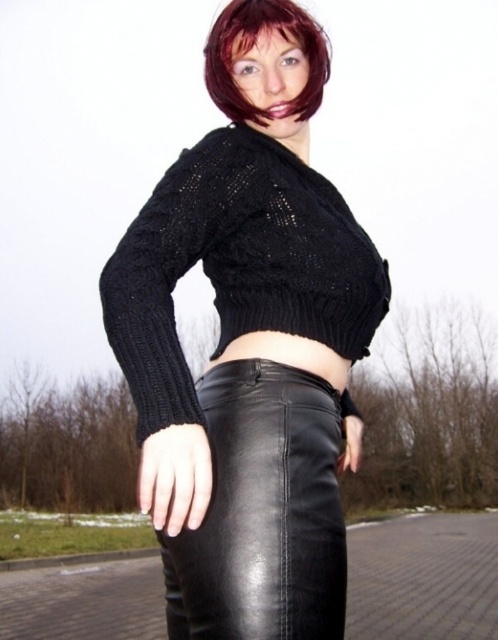
Can you confirm if black leather skirt at lower center is thinner than dark brown hair at upper center?

No, black leather skirt at lower center is not thinner than dark brown hair at upper center.

Which is in front, point (336, 572) or point (252, 112)?

Point (336, 572)

Where is `black leather skirt at lower center`? This screenshot has height=640, width=498. black leather skirt at lower center is located at coordinates (262, 513).

Who is taller, black leather skirt at center or dark red hair at upper center?

With more height is black leather skirt at center.

Can you confirm if black leather skirt at center is taller than dark red hair at upper center?

Correct, black leather skirt at center is much taller as dark red hair at upper center.

Is point (343, 396) in front of point (236, 33)?

That is False.

This screenshot has height=640, width=498. Find the location of `black leather skirt at center`. black leather skirt at center is located at coordinates (249, 349).

Which is behind, point (211, 408) or point (268, 33)?

The point (268, 33) is behind.

Does point (296, 636) come in front of point (250, 29)?

Yes.

The height and width of the screenshot is (640, 498). Identify the location of black leather skirt at lower center. (262, 513).